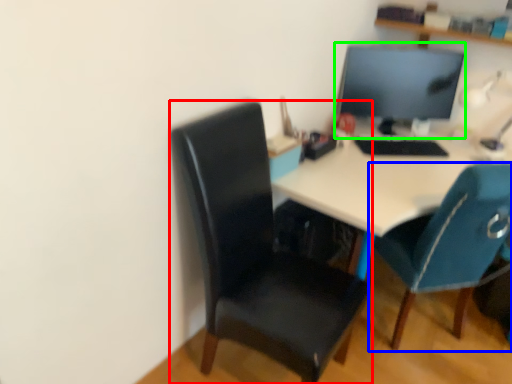
Question: Which object is positioned farthest from chair (highlighted by a red box)? Select from chair (highlighted by a blue box) and computer monitor (highlighted by a green box).

Choices:
 (A) chair
 (B) computer monitor

Answer: (B)